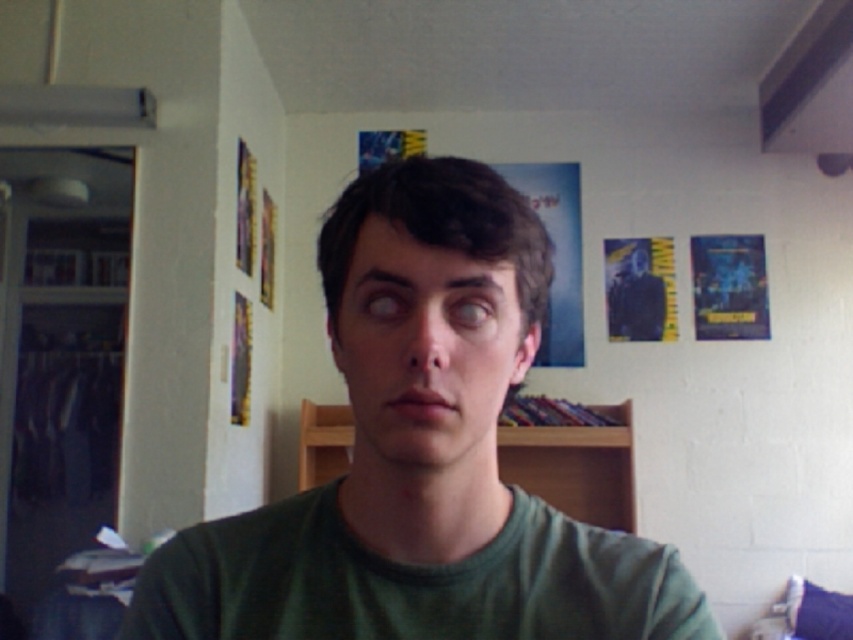
Is green matte shirt at center wider than wooden bookshelf at center?

In fact, green matte shirt at center might be narrower than wooden bookshelf at center.

Is point (451, 577) positioned after point (546, 435)?

No.

Does point (170, 627) lie in front of point (323, 465)?

Yes, it is in front of point (323, 465).

You are a GUI agent. You are given a task and a screenshot of the screen. Output one action in this format:
    pyautogui.click(x=<x>, y=<y>)
    Task: Click on the green matte shirt at center
    Image resolution: width=853 pixels, height=640 pixels.
    Given the screenshot: What is the action you would take?
    pyautogui.click(x=421, y=456)